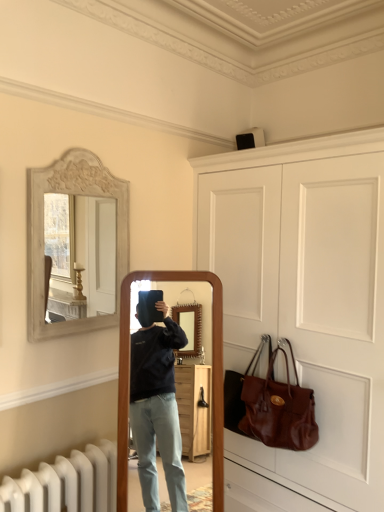
Locate an element on the screen. This screenshot has height=512, width=384. vacant space underneath white carved wood mirror at upper left (from a real-world perspective) is located at coordinates (76, 370).